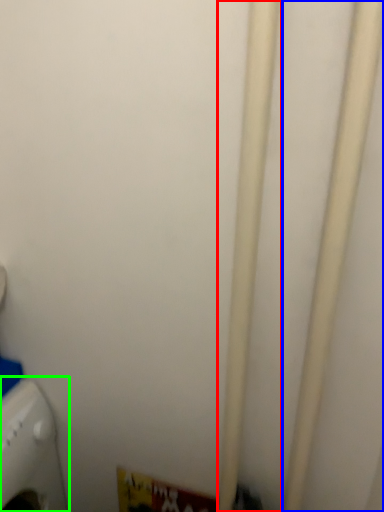
Question: Which is nearer to the pipe (highlighted by a red box)? pipe (highlighted by a blue box) or home appliance (highlighted by a green box).

Choices:
 (A) pipe
 (B) home appliance

Answer: (A)